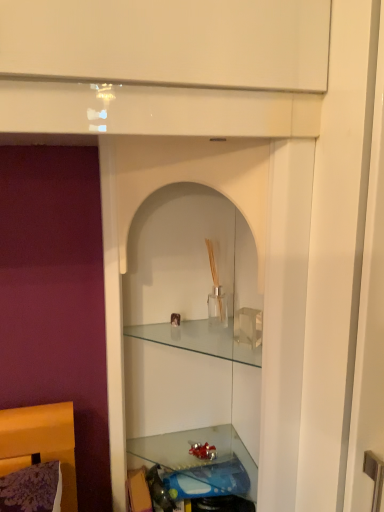
Question: Which direction should I rotate to look at clear glass cabinet at center, marked as the 1th cabinet in a bottom-to-top arrangement, — up or down?

Choices:
 (A) down
 (B) up

Answer: (A)

Question: Considering the relative sizes of clear glass cabinet at center, marked as the 1th cabinet in a bottom-to-top arrangement, and clear glass vase at center, which ranks as the second cabinet in bottom-to-top order, in the image provided, is clear glass cabinet at center, marked as the 1th cabinet in a bottom-to-top arrangement, bigger than clear glass vase at center, which ranks as the second cabinet in bottom-to-top order,?

Choices:
 (A) no
 (B) yes

Answer: (B)

Question: Is clear glass cabinet at center, marked as the 1th cabinet in a bottom-to-top arrangement, beside clear glass vase at center, the first cabinet viewed from the top?

Choices:
 (A) yes
 (B) no

Answer: (B)

Question: Considering the relative positions of clear glass cabinet at center, marked as the second cabinet in a top-to-bottom arrangement, and clear glass vase at center, the first cabinet viewed from the top, in the image provided, is clear glass cabinet at center, marked as the second cabinet in a top-to-bottom arrangement, to the right of clear glass vase at center, the first cabinet viewed from the top, from the viewer's perspective?

Choices:
 (A) yes
 (B) no

Answer: (B)

Question: Considering the relative positions of clear glass cabinet at center, marked as the 1th cabinet in a bottom-to-top arrangement, and clear glass vase at center, the first cabinet viewed from the top, in the image provided, is clear glass cabinet at center, marked as the 1th cabinet in a bottom-to-top arrangement, to the left of clear glass vase at center, the first cabinet viewed from the top, from the viewer's perspective?

Choices:
 (A) no
 (B) yes

Answer: (B)

Question: Considering the relative sizes of clear glass cabinet at center, marked as the 1th cabinet in a bottom-to-top arrangement, and clear glass vase at center, which ranks as the second cabinet in bottom-to-top order, in the image provided, is clear glass cabinet at center, marked as the 1th cabinet in a bottom-to-top arrangement, thinner than clear glass vase at center, which ranks as the second cabinet in bottom-to-top order,?

Choices:
 (A) yes
 (B) no

Answer: (B)

Question: Would you say clear glass cabinet at center, marked as the 1th cabinet in a bottom-to-top arrangement, is outside clear glass vase at center, the first cabinet viewed from the top?

Choices:
 (A) yes
 (B) no

Answer: (A)

Question: Is translucent glass shelf at lower center at the back of clear glass vase at center, which ranks as the second cabinet in bottom-to-top order?

Choices:
 (A) no
 (B) yes

Answer: (A)

Question: Is clear glass vase at center, which ranks as the second cabinet in bottom-to-top order, smaller than translucent glass shelf at lower center?

Choices:
 (A) yes
 (B) no

Answer: (A)

Question: Can you confirm if clear glass vase at center, which ranks as the second cabinet in bottom-to-top order, is thinner than translucent glass shelf at lower center?

Choices:
 (A) yes
 (B) no

Answer: (A)

Question: Does clear glass vase at center, which ranks as the second cabinet in bottom-to-top order, contain translucent glass shelf at lower center?

Choices:
 (A) no
 (B) yes

Answer: (A)

Question: Considering the relative positions of clear glass vase at center, which ranks as the second cabinet in bottom-to-top order, and translucent glass shelf at lower center in the image provided, is clear glass vase at center, which ranks as the second cabinet in bottom-to-top order, to the left of translucent glass shelf at lower center from the viewer's perspective?

Choices:
 (A) no
 (B) yes

Answer: (A)

Question: Does clear glass vase at center, the first cabinet viewed from the top, have a larger size compared to translucent glass shelf at lower center?

Choices:
 (A) no
 (B) yes

Answer: (A)

Question: Is translucent glass shelf at lower center positioned beyond the bounds of clear glass cabinet at center, marked as the second cabinet in a top-to-bottom arrangement?

Choices:
 (A) no
 (B) yes

Answer: (A)